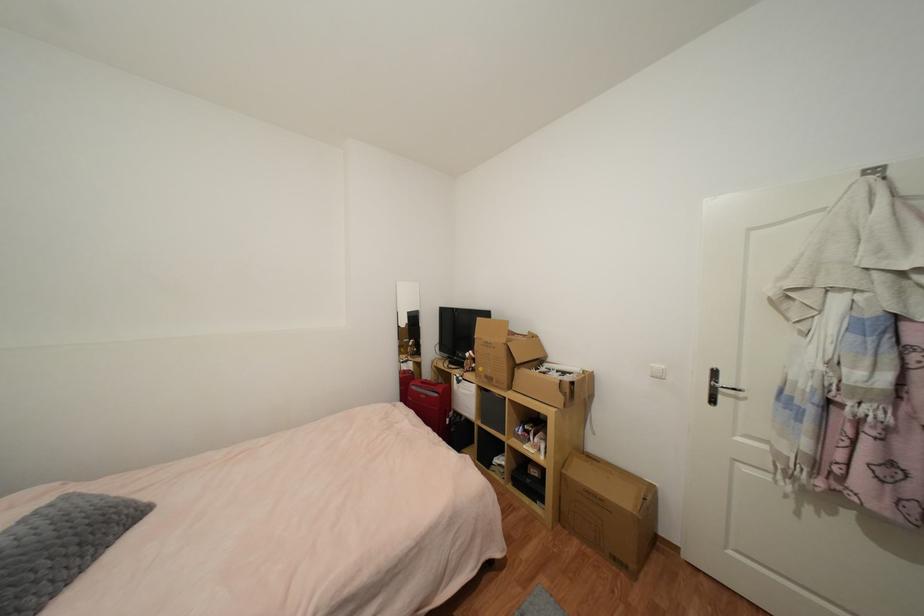
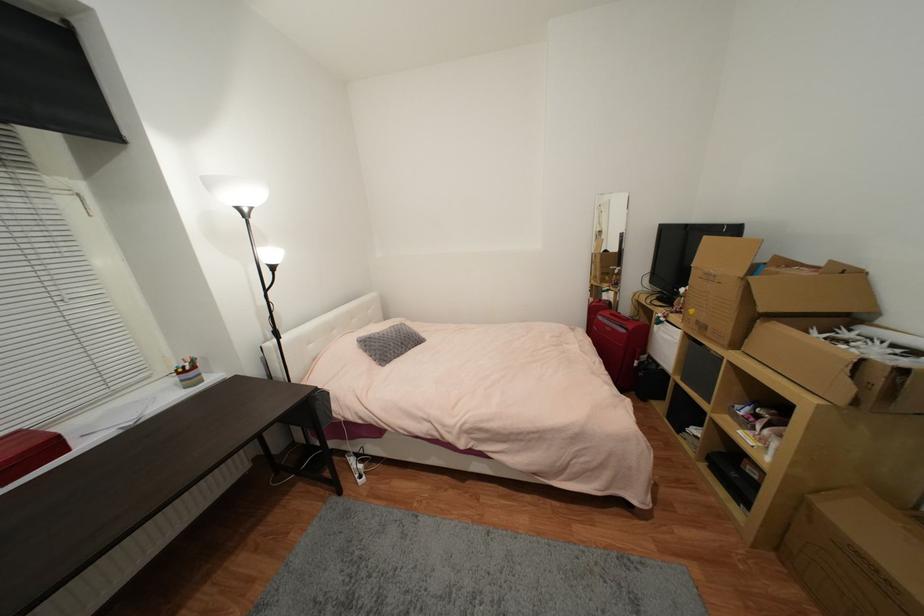
Where in the second image is the point corresponding to point (494, 381) from the first image?

(708, 329)